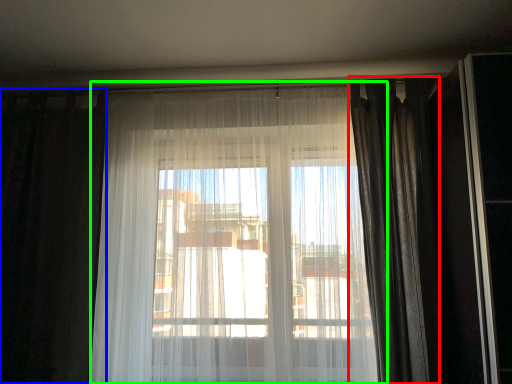
Question: Which object is the closest to the curtain (highlighted by a red box)? Choose among these: curtain (highlighted by a blue box) or curtain (highlighted by a green box).

Choices:
 (A) curtain
 (B) curtain

Answer: (B)